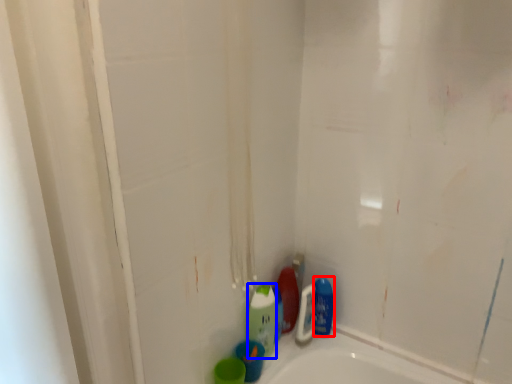
Question: Which object is further to the camera taking this photo, mouthwash (highlighted by a red box) or cleaning product (highlighted by a blue box)?

Choices:
 (A) mouthwash
 (B) cleaning product

Answer: (A)